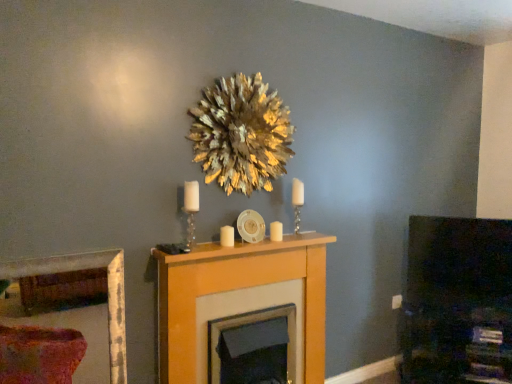
Question: Is white glossy candle at center, the second candle when ordered from front to back, completely or partially outside of wooden picture frame at lower left?

Choices:
 (A) no
 (B) yes

Answer: (B)

Question: Is white glossy candle at center, the 1th candle in the back-to-front sequence, not near wooden picture frame at lower left?

Choices:
 (A) yes
 (B) no

Answer: (A)

Question: Is white glossy candle at center, which appears as the first candle when viewed from the right, smaller than wooden picture frame at lower left?

Choices:
 (A) yes
 (B) no

Answer: (A)

Question: From a real-world perspective, does white glossy candle at center, the second candle when ordered from front to back, stand above wooden picture frame at lower left?

Choices:
 (A) no
 (B) yes

Answer: (B)

Question: Considering the relative sizes of white glossy candle at center, the 1th candle in the back-to-front sequence, and wooden picture frame at lower left in the image provided, is white glossy candle at center, the 1th candle in the back-to-front sequence, bigger than wooden picture frame at lower left?

Choices:
 (A) yes
 (B) no

Answer: (B)

Question: From a real-world perspective, is white glossy candle at center, which appears as the first candle when viewed from the right, physically below wooden picture frame at lower left?

Choices:
 (A) no
 (B) yes

Answer: (A)

Question: From the image's perspective, is wooden mantel at center located beneath white matte candle at center, the first candle in the left-to-right sequence?

Choices:
 (A) yes
 (B) no

Answer: (A)

Question: Does wooden mantel at center have a greater height compared to white matte candle at center, the first candle from the front?

Choices:
 (A) yes
 (B) no

Answer: (A)

Question: Is white matte candle at center, which ranks as the 2th candle in back-to-front order, a part of wooden mantel at center?

Choices:
 (A) yes
 (B) no

Answer: (B)

Question: From a real-world perspective, is wooden mantel at center physically below white matte candle at center, the first candle from the front?

Choices:
 (A) yes
 (B) no

Answer: (A)

Question: Is wooden mantel at center facing away from white matte candle at center, the first candle in the left-to-right sequence?

Choices:
 (A) yes
 (B) no

Answer: (B)

Question: Could you tell me if wooden mantel at center is turned towards white matte candle at center, the first candle in the left-to-right sequence?

Choices:
 (A) no
 (B) yes

Answer: (A)

Question: Is gold leafy wreath at upper center positioned before wooden mantel at center?

Choices:
 (A) yes
 (B) no

Answer: (B)